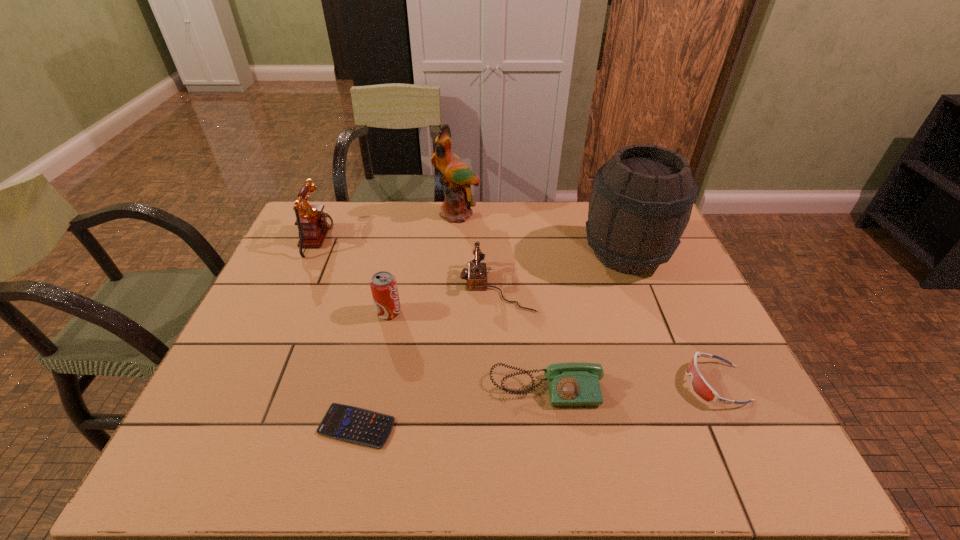
Identify the location of free space between the wine bucket and the sixth tallest object. The height and width of the screenshot is (540, 960). (586, 321).

The height and width of the screenshot is (540, 960). In order to click on vacant area that lies between the goggles and the fourth tallest object in this screenshot , I will do `click(552, 348)`.

At what (x,y) coordinates should I click in order to perform the action: click on empty space between the parrot and the calculator. Please return your answer as a coordinate pair (x, y). Looking at the image, I should click on 407,320.

At what (x,y) coordinates should I click in order to perform the action: click on free area in between the parrot and the goggles. Please return your answer as a coordinate pair (x, y). This screenshot has width=960, height=540. Looking at the image, I should click on (587, 299).

In order to click on unoccupied area between the leftmost telephone and the calculator in this screenshot , I will do `click(338, 333)`.

Locate an element on the screen. This screenshot has width=960, height=540. free space between the second shortest object and the nearest telephone is located at coordinates (631, 386).

Locate an element on the screen. The width and height of the screenshot is (960, 540). empty location between the fifth shortest object and the second nearest telephone is located at coordinates (443, 299).

Locate an element on the screen. the fifth closest object to the parrot is located at coordinates (575, 383).

Select which object appears as the sixth closest to the shortest telephone. Please provide its 2D coordinates. Your answer should be formatted as a tuple, i.e. [(x, y)], where the tuple contains the x and y coordinates of a point satisfying the conditions above.

[(457, 177)]

The width and height of the screenshot is (960, 540). Identify the location of telephone that stands as the second closest to the second nearest telephone. (313, 224).